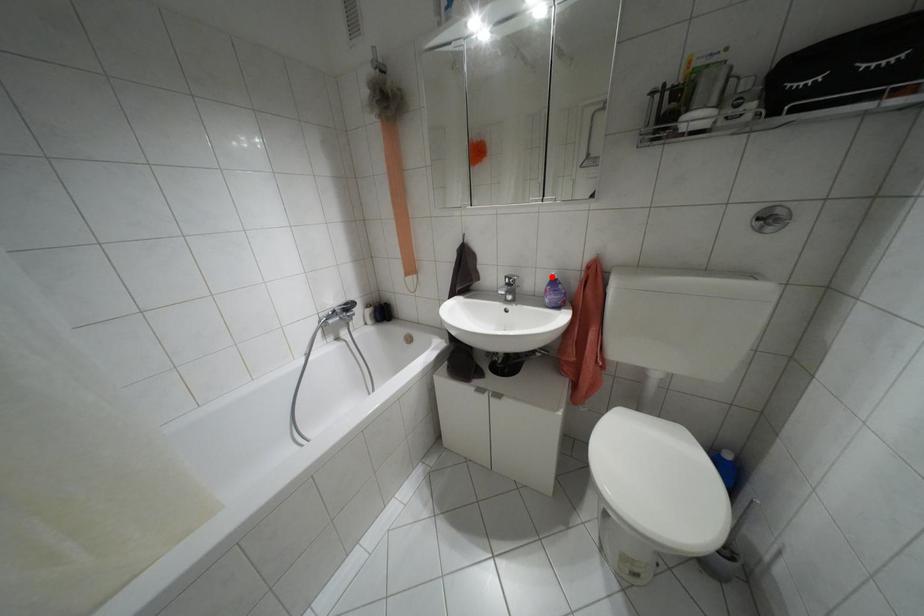
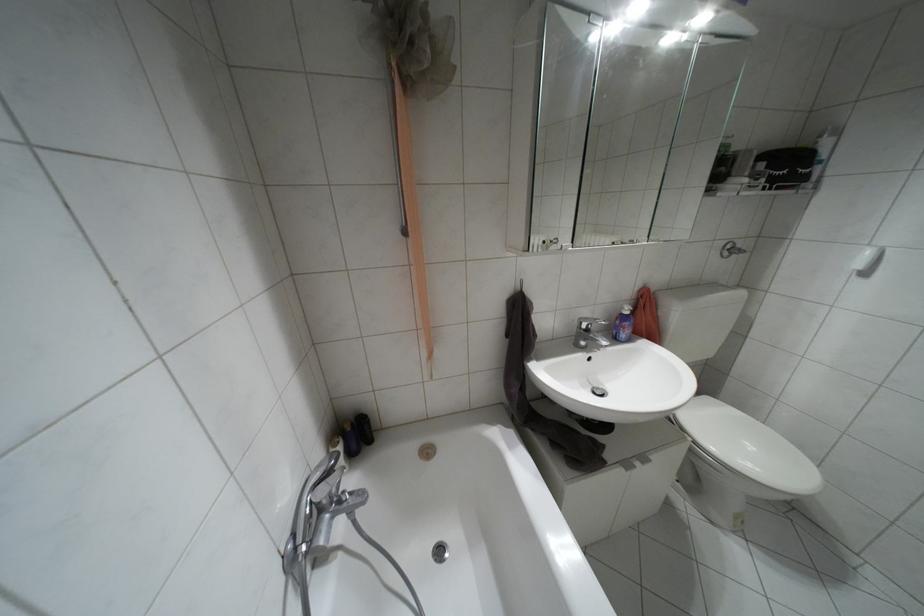
Find the pixel in the second image that matches the highlighted location in the first image.

(626, 312)